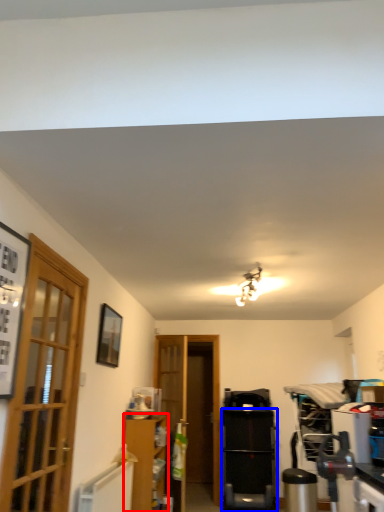
Question: Which object appears farthest to the camera in this image, cabinetry (highlighted by a red box) or appliance (highlighted by a blue box)?

Choices:
 (A) cabinetry
 (B) appliance

Answer: (B)